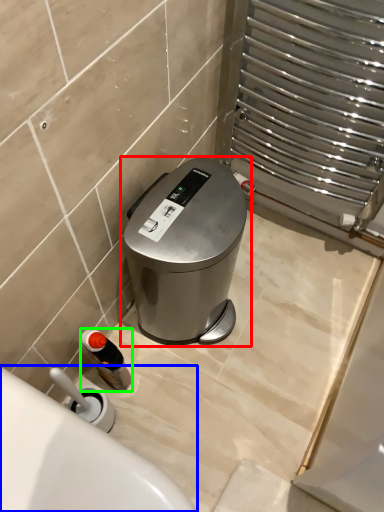
Question: Which object is the closest to the waste container (highlighted by a red box)? Choose among these: bath (highlighted by a blue box) or bottle (highlighted by a green box).

Choices:
 (A) bath
 (B) bottle

Answer: (B)